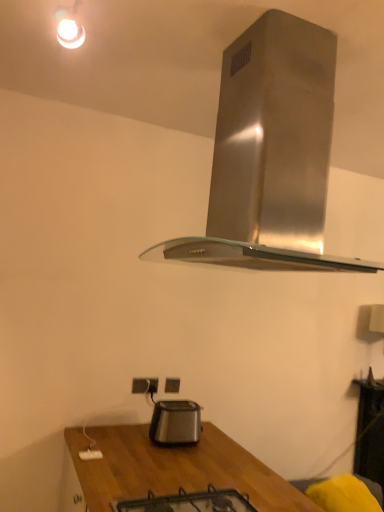
Question: Based on their sizes in the image, would you say black glass gas stove at lower center is bigger or smaller than stainless steel range hood at upper center?

Choices:
 (A) small
 (B) big

Answer: (A)

Question: From the image's perspective, is black glass gas stove at lower center above or below stainless steel range hood at upper center?

Choices:
 (A) below
 (B) above

Answer: (A)

Question: Considering the real-world distances, which object is closest to the white plastic electric outlet at lower center, arranged as the first electric outlet when viewed from the left?

Choices:
 (A) black glass gas stove at lower center
 (B) satin black toaster at lower center
 (C) stainless steel range hood at upper center
 (D) matte black electric outlet at lower center, marked as the 2th electric outlet in a front-to-back arrangement

Answer: (D)

Question: Considering the real-world distances, which object is farthest from the stainless steel range hood at upper center?

Choices:
 (A) satin black toaster at lower center
 (B) black glass gas stove at lower center
 (C) matte black electric outlet at lower center, marked as the 2th electric outlet in a front-to-back arrangement
 (D) white plastic electric outlet at lower center, the second electric outlet in the right-to-left sequence

Answer: (C)